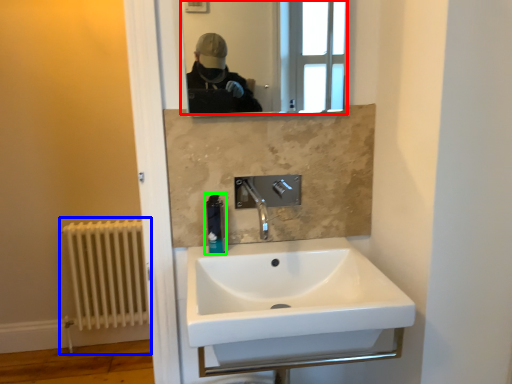
Question: Estimate the real-world distances between objects in this image. Which object is farther from mirror (highlighted by a red box), radiator (highlighted by a blue box) or soap dispenser (highlighted by a green box)?

Choices:
 (A) radiator
 (B) soap dispenser

Answer: (B)